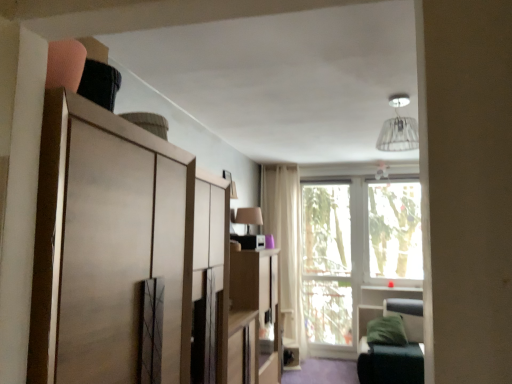
Locate an element on the screen. green leather bunk bed at lower right is located at coordinates (395, 349).

Locate an element on the screen. transparent glass window at center, the 1th window screen when ordered from right to left is located at coordinates (395, 230).

Describe the element at coordinates (327, 263) in the screenshot. I see `transparent glass window at center, the first window screen in the left-to-right sequence` at that location.

Where is `green leather bunk bed at lower right`? The image size is (512, 384). green leather bunk bed at lower right is located at coordinates (395, 349).

From the picture: Would you consider green leather bunk bed at lower right to be distant from matte beige lampshade at upper center?

Absolutely, green leather bunk bed at lower right is distant from matte beige lampshade at upper center.

Does green leather bunk bed at lower right have a lesser height compared to matte beige lampshade at upper center?

No, green leather bunk bed at lower right is not shorter than matte beige lampshade at upper center.

Is green leather bunk bed at lower right facing towards matte beige lampshade at upper center?

No.

Is green leather bunk bed at lower right thinner than matte beige lampshade at upper center?

Incorrect, the width of green leather bunk bed at lower right is not less than that of matte beige lampshade at upper center.

How different are the orientations of white fabric lampshade at upper center and matte wood cabinet at upper left, the 2th cabinetry viewed from the back, in degrees?

There is a 89.4-degree angle between the facing directions of white fabric lampshade at upper center and matte wood cabinet at upper left, the 2th cabinetry viewed from the back.

From a real-world perspective, which is physically above, white fabric lampshade at upper center or matte wood cabinet at upper left, the first cabinetry from the left?

From a 3D spatial view, white fabric lampshade at upper center is above.

Is white fabric lampshade at upper center bigger or smaller than matte wood cabinet at upper left, the 2th cabinetry viewed from the right?

Considering their sizes, white fabric lampshade at upper center takes up less space than matte wood cabinet at upper left, the 2th cabinetry viewed from the right.

From the image's perspective, is white fabric lampshade at upper center above or below matte wood cabinet at upper left, the second cabinetry ordered from the bottom?

From the image's perspective, white fabric lampshade at upper center appears above matte wood cabinet at upper left, the second cabinetry ordered from the bottom.

Does matte wood cabinet at upper left, the 2th cabinetry viewed from the back, have a greater height compared to transparent glass window at center, placed as the second window screen when sorted from right to left?

No.

Is matte wood cabinet at upper left, the first cabinetry positioned from the front, far away from transparent glass window at center, the first window screen in the left-to-right sequence?

That's right, there is a large distance between matte wood cabinet at upper left, the first cabinetry positioned from the front, and transparent glass window at center, the first window screen in the left-to-right sequence.

Which is closer to the camera, [105,328] or [309,310]?

The point [105,328] is closer to the camera.

Looking at this image, what's the angular difference between matte wood cabinet at upper left, the 2th cabinetry viewed from the back, and transparent glass window at center, placed as the second window screen when sorted from right to left,'s facing directions?

There is a 91.2-degree angle between the facing directions of matte wood cabinet at upper left, the 2th cabinetry viewed from the back, and transparent glass window at center, placed as the second window screen when sorted from right to left.

From the image's perspective, is matte beige lampshade at upper center located beneath transparent glass window at center, the 1th window screen when ordered from right to left?

No.

Can transparent glass window at center, which appears as the second window screen when viewed from the left, be found inside matte beige lampshade at upper center?

That's incorrect, transparent glass window at center, which appears as the second window screen when viewed from the left, is not inside matte beige lampshade at upper center.

Considering the positions of objects white fabric lampshade at upper center and wooden cabinet at center, which is counted as the first cabinetry, starting from the back, in the image provided, who is behind, white fabric lampshade at upper center or wooden cabinet at center, which is counted as the first cabinetry, starting from the back,?

wooden cabinet at center, which is counted as the first cabinetry, starting from the back, is further away from the camera.

Considering the sizes of objects white fabric lampshade at upper center and wooden cabinet at center, marked as the 2th cabinetry in a top-to-bottom arrangement, in the image provided, who is smaller, white fabric lampshade at upper center or wooden cabinet at center, marked as the 2th cabinetry in a top-to-bottom arrangement,?

Smaller between the two is white fabric lampshade at upper center.

Is white fabric lampshade at upper center located outside wooden cabinet at center, marked as the 1th cabinetry in a bottom-to-top arrangement?

white fabric lampshade at upper center lies outside wooden cabinet at center, marked as the 1th cabinetry in a bottom-to-top arrangement,'s area.

Locate an element on the screen. Image resolution: width=512 pixels, height=384 pixels. light fixture on the right of wooden cabinet at center, marked as the 2th cabinetry in a top-to-bottom arrangement is located at coordinates (398, 128).

From the image's perspective, is transparent glass window at center, the 1th window screen when ordered from right to left, under matte wood cabinet at upper left, the 2th cabinetry viewed from the back?

Yes, from the image's perspective, transparent glass window at center, the 1th window screen when ordered from right to left, is beneath matte wood cabinet at upper left, the 2th cabinetry viewed from the back.

Which object is wider, transparent glass window at center, which appears as the second window screen when viewed from the left, or matte wood cabinet at upper left, the 2th cabinetry viewed from the right?

With larger width is matte wood cabinet at upper left, the 2th cabinetry viewed from the right.

Considering their positions, is transparent glass window at center, which appears as the second window screen when viewed from the left, located in front of or behind matte wood cabinet at upper left, the second cabinetry ordered from the bottom?

In the image, transparent glass window at center, which appears as the second window screen when viewed from the left, appears behind matte wood cabinet at upper left, the second cabinetry ordered from the bottom.

Could you measure the distance between transparent glass window at center, which appears as the second window screen when viewed from the left, and matte wood cabinet at upper left, which is the 1th cabinetry in top-to-bottom order?

transparent glass window at center, which appears as the second window screen when viewed from the left, and matte wood cabinet at upper left, which is the 1th cabinetry in top-to-bottom order, are 4.64 meters apart.

Could you tell me if green leather bunk bed at lower right is turned towards white fabric lampshade at upper center?

No, green leather bunk bed at lower right is not turned towards white fabric lampshade at upper center.

Does green leather bunk bed at lower right have a greater height compared to white fabric lampshade at upper center?

Indeed, green leather bunk bed at lower right has a greater height compared to white fabric lampshade at upper center.

Measure the distance between green leather bunk bed at lower right and white fabric lampshade at upper center.

A distance of 7.27 feet exists between green leather bunk bed at lower right and white fabric lampshade at upper center.

Image resolution: width=512 pixels, height=384 pixels. I want to click on bunk bed on the right of matte beige lampshade at upper center, so click(x=395, y=349).

From the image's perspective, count 1st cabinetrys downward from the white fabric lampshade at upper center and point to it. Please provide its 2D coordinates.

[(105, 244)]

Based on their spatial positions, is beige fabric curtain at center or transparent glass window at center, placed as the second window screen when sorted from right to left, further from matte wood cabinet at upper left, the second cabinetry ordered from the bottom?

transparent glass window at center, placed as the second window screen when sorted from right to left, is further to matte wood cabinet at upper left, the second cabinetry ordered from the bottom.

Based on their spatial positions, is white fabric lampshade at upper center or transparent glass window at center, placed as the second window screen when sorted from right to left, further from transparent glass window at center, which appears as the second window screen when viewed from the left?

white fabric lampshade at upper center lies further to transparent glass window at center, which appears as the second window screen when viewed from the left, than the other object.

When comparing their distances from white fabric lampshade at upper center, does transparent glass window at center, which appears as the second window screen when viewed from the left, or transparent glass window at center, placed as the second window screen when sorted from right to left, seem closer?

transparent glass window at center, placed as the second window screen when sorted from right to left, is positioned closer to the anchor white fabric lampshade at upper center.

When comparing their distances from transparent glass window at center, the first window screen in the left-to-right sequence, does green leather bunk bed at lower right or beige fabric curtain at center seem closer?

Among the two, beige fabric curtain at center is located nearer to transparent glass window at center, the first window screen in the left-to-right sequence.

When comparing their distances from white fabric lampshade at upper center, does matte wood cabinet at upper left, the 2th cabinetry viewed from the right, or transparent glass window at center, the 1th window screen when ordered from right to left, seem further?

transparent glass window at center, the 1th window screen when ordered from right to left, is further to white fabric lampshade at upper center.

Which object lies further to the anchor point white fabric lampshade at upper center, wooden cabinet at center, positioned as the first cabinetry in right-to-left order, or matte wood cabinet at upper left, the first cabinetry positioned from the front?

Based on the image, matte wood cabinet at upper left, the first cabinetry positioned from the front, appears to be further to white fabric lampshade at upper center.

Consider the image. When comparing their distances from green leather bunk bed at lower right, does transparent glass window at center, placed as the second window screen when sorted from right to left, or beige fabric curtain at center seem closer?

The object closer to green leather bunk bed at lower right is transparent glass window at center, placed as the second window screen when sorted from right to left.

Looking at the image, which one is located closer to transparent glass window at center, the 1th window screen when ordered from right to left, white fabric lampshade at upper center or green leather bunk bed at lower right?

green leather bunk bed at lower right is closer to transparent glass window at center, the 1th window screen when ordered from right to left.

Find the location of a particular element. This screenshot has height=384, width=512. cabinetry between matte wood cabinet at upper left, the second cabinetry ordered from the bottom, and beige fabric curtain at center in the front-back direction is located at coordinates coord(255,311).

What are the coordinates of `cabinetry between matte wood cabinet at upper left, the 2th cabinetry viewed from the back, and green leather bunk bed at lower right in the front-back direction` in the screenshot? It's located at (255, 311).

Where is `lamp between white fabric lampshade at upper center and green leather bunk bed at lower right from top to bottom`? This screenshot has width=512, height=384. lamp between white fabric lampshade at upper center and green leather bunk bed at lower right from top to bottom is located at coordinates (249, 216).

Image resolution: width=512 pixels, height=384 pixels. What are the coordinates of `light fixture between matte wood cabinet at upper left, the 2th cabinetry viewed from the right, and transparent glass window at center, placed as the second window screen when sorted from right to left, along the z-axis` in the screenshot? It's located at (398, 128).